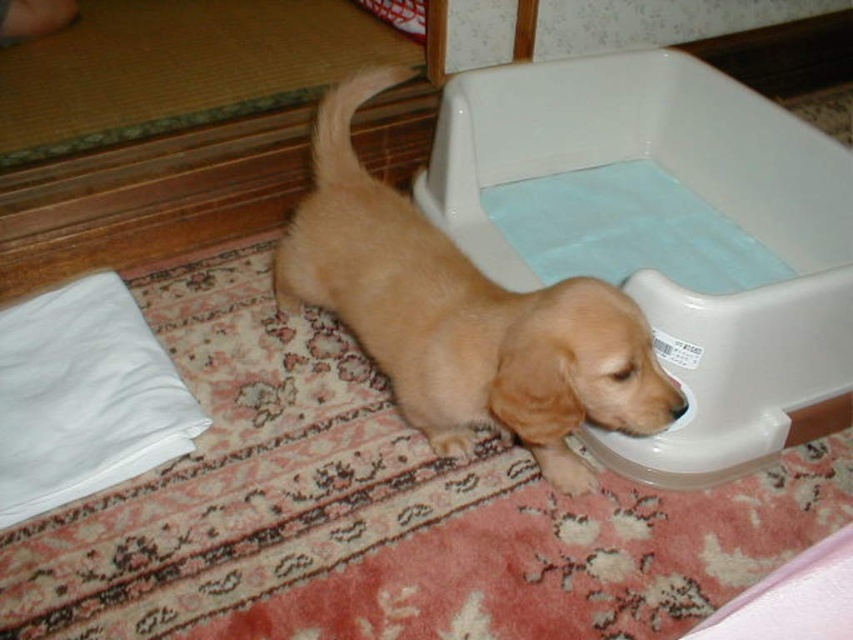
Does white plastic tub at lower right appear on the right side of golden fur dog at center?

Yes, white plastic tub at lower right is to the right of golden fur dog at center.

This screenshot has width=853, height=640. Describe the element at coordinates (693, 186) in the screenshot. I see `white plastic tub at lower right` at that location.

You are a GUI agent. You are given a task and a screenshot of the screen. Output one action in this format:
    pyautogui.click(x=<x>, y=<y>)
    Task: Click on the white plastic tub at lower right
    The height and width of the screenshot is (640, 853).
    Given the screenshot: What is the action you would take?
    pyautogui.click(x=693, y=186)